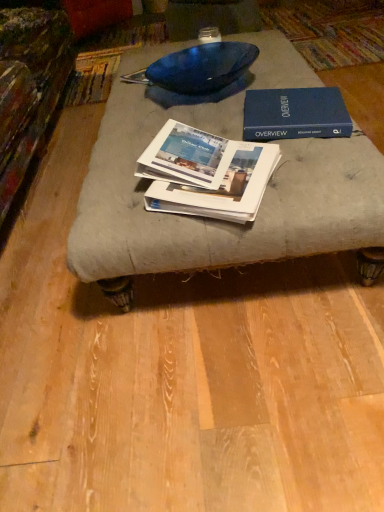
Question: Is white paper booklet at center, positioned as the 2th book in bottom-to-top order, closer to the viewer compared to white glossy book at center, marked as the third book in a top-to-bottom arrangement?

Choices:
 (A) no
 (B) yes

Answer: (A)

Question: Can you confirm if white paper booklet at center, which is the second book in top-to-bottom order, is thinner than white glossy book at center, marked as the third book in a top-to-bottom arrangement?

Choices:
 (A) no
 (B) yes

Answer: (B)

Question: Is white paper booklet at center, positioned as the 2th book in bottom-to-top order, taller than white glossy book at center, the 1th book ordered from the bottom?

Choices:
 (A) yes
 (B) no

Answer: (A)

Question: From a real-world perspective, is white paper booklet at center, positioned as the 2th book in bottom-to-top order, beneath white glossy book at center, the 1th book ordered from the bottom?

Choices:
 (A) yes
 (B) no

Answer: (B)

Question: Is white paper booklet at center, which is the second book in top-to-bottom order, shorter than white glossy book at center, the 1th book ordered from the bottom?

Choices:
 (A) yes
 (B) no

Answer: (B)

Question: Looking at the image, does blue hardcover book at upper right, the 3th book in the bottom-to-top sequence, seem bigger or smaller compared to white paper booklet at center, positioned as the 2th book in bottom-to-top order?

Choices:
 (A) small
 (B) big

Answer: (B)

Question: In terms of width, does blue hardcover book at upper right, the 3th book in the bottom-to-top sequence, look wider or thinner when compared to white paper booklet at center, which is the second book in top-to-bottom order?

Choices:
 (A) thin
 (B) wide

Answer: (B)

Question: From a real-world perspective, relative to white paper booklet at center, which is the second book in top-to-bottom order, is blue hardcover book at upper right, the 3th book in the bottom-to-top sequence, vertically above or below?

Choices:
 (A) above
 (B) below

Answer: (B)

Question: Does point (337, 103) appear closer or farther from the camera than point (140, 159)?

Choices:
 (A) farther
 (B) closer

Answer: (A)

Question: From their relative heights in the image, would you say white glossy book at center, the 1th book ordered from the bottom, is taller or shorter than blue hardcover book at upper right, which is counted as the first book, starting from the top?

Choices:
 (A) tall
 (B) short

Answer: (B)

Question: Visually, is white glossy book at center, marked as the third book in a top-to-bottom arrangement, positioned to the left or to the right of blue hardcover book at upper right, which is counted as the first book, starting from the top?

Choices:
 (A) right
 (B) left

Answer: (B)

Question: From a real-world perspective, is white glossy book at center, the 1th book ordered from the bottom, positioned above or below blue hardcover book at upper right, the 3th book in the bottom-to-top sequence?

Choices:
 (A) below
 (B) above

Answer: (A)

Question: Is white glossy book at center, marked as the third book in a top-to-bottom arrangement, bigger or smaller than blue hardcover book at upper right, which is counted as the first book, starting from the top?

Choices:
 (A) small
 (B) big

Answer: (A)

Question: From the image's perspective, relative to white glossy book at center, the 1th book ordered from the bottom, is white paper booklet at center, which is the second book in top-to-bottom order, above or below?

Choices:
 (A) above
 (B) below

Answer: (A)

Question: Looking at their shapes, would you say white paper booklet at center, which is the second book in top-to-bottom order, is wider or thinner than white glossy book at center, marked as the third book in a top-to-bottom arrangement?

Choices:
 (A) thin
 (B) wide

Answer: (A)